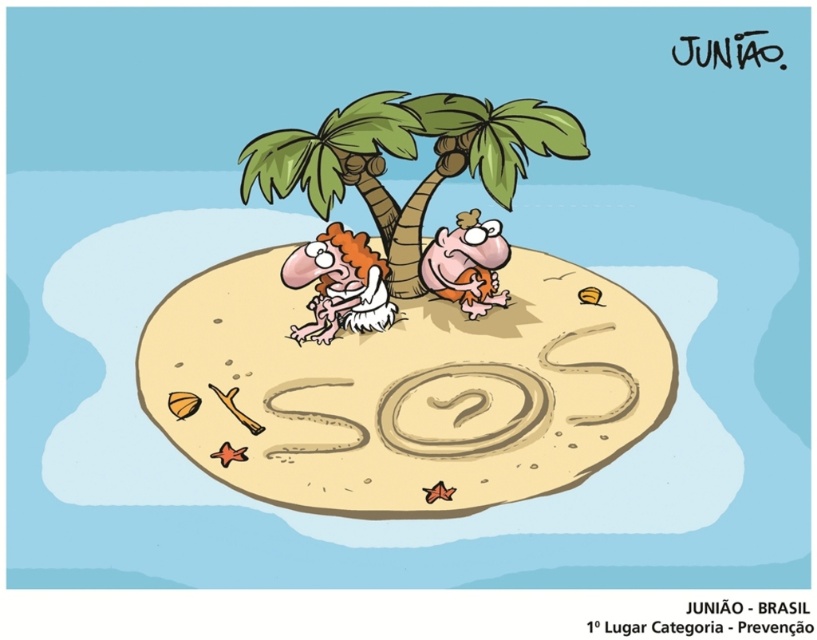
You are a drone operator trying to locate two points on the island. The first point is at coordinates point (x=453, y=96), and the second is at point (x=309, y=262). Which point is nearer to your drone camera?

Point (x=453, y=96) is closer to the camera than point (x=309, y=262), so the first point is nearer to your drone camera.

You are a stranded survivor on the island and need to climb the tallest object to signal for help. Which object should you climb between the green leafy palm tree at upper center and the orange fabric monkey at center?

The green leafy palm tree at upper center is much taller than the orange fabric monkey at center, so you should climb the green leafy palm tree at upper center to get a better vantage point for signaling help.